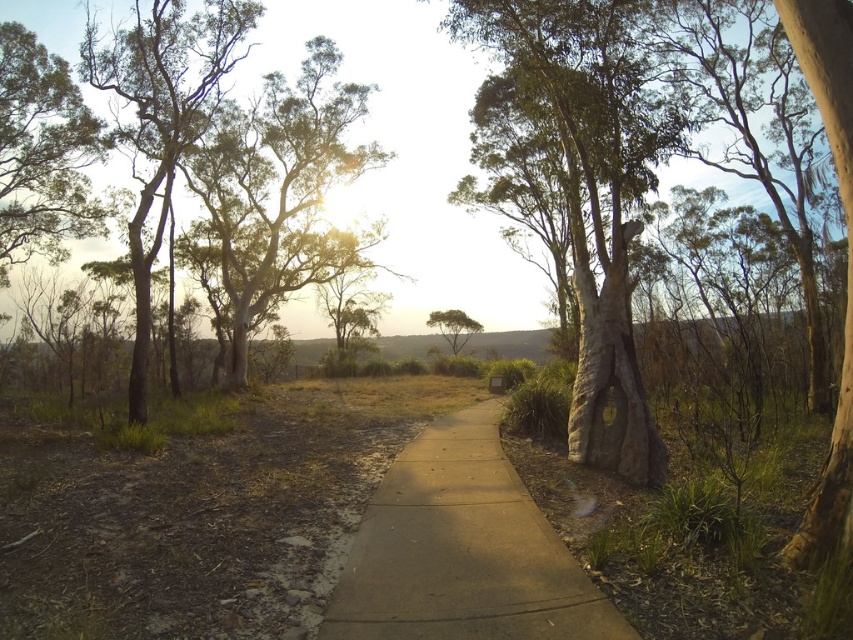
You are a gardener planning to plant a new tree along the existing pathway. The concrete at center is currently narrower than the brown rough bark tree at right. If you want to ensure the new tree has enough space to grow without encroaching on the pathway, which object should you consider the width of when determining the planting distance?

You should consider the width of the brown rough bark tree at right because the concrete at center has a lesser width compared to it, meaning the tree is wider. To avoid encroachment, the planting distance should account for the tree width of the brown rough bark tree at right.

Consider the image. You are a hiker who wants to take a photo of the green leafy tree at upper left without the concrete at center blocking the view. Where should you move to achieve this?

Move behind the concrete at center so that the green leafy tree at upper left is visible without obstruction.

You are standing at the starting point of the pathway and want to place a decorative stone exactly at the center of the concrete at center. According to the coordinates provided, where should you place the stone?

The decorative stone should be placed at the coordinates point [462,550], which is the exact center of the concrete at center as specified.